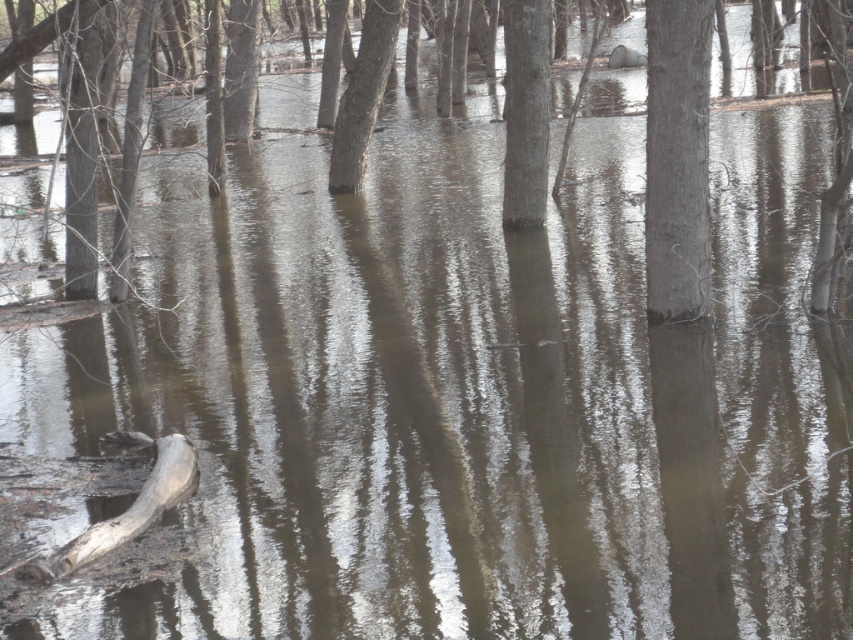
You are a kayaker navigating through the flooded forest. You see the smooth gray tree trunk at center and the gray wood log at lower left. Which object is closer to the water surface?

The smooth gray tree trunk at center is positioned over the gray wood log at lower left, meaning it is closer to the water surface.

You are a photographer standing at the edge of the flooded forest. You want to capture a detailed shot of the point at coordinates point (825, 296). Given that your camera has a maximum focus range of 12 meters, will you be able to focus on that point?

The distance of point (825, 296) from camera is 12.74 meters, which exceeds the camera maximum focus range of 12 meters. Therefore, you will not be able to focus on that point.

You are a hiker trying to cross the flooded area in the image. You notice two trees in the center. Which tree, the smooth gray tree trunk at center or the brown matte tree at center, would be easier to grip for support?

The smooth gray tree trunk at center has a smaller size compared to the brown matte tree at center, so the brown matte tree at center would provide a better grip for support due to its larger size.